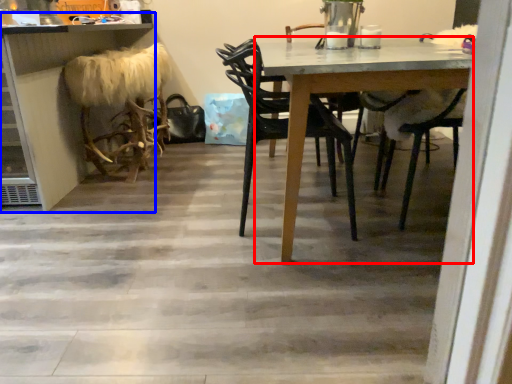
Question: Among these objects, which one is nearest to the camera, table (highlighted by a red box) or counter (highlighted by a blue box)?

Choices:
 (A) table
 (B) counter

Answer: (A)